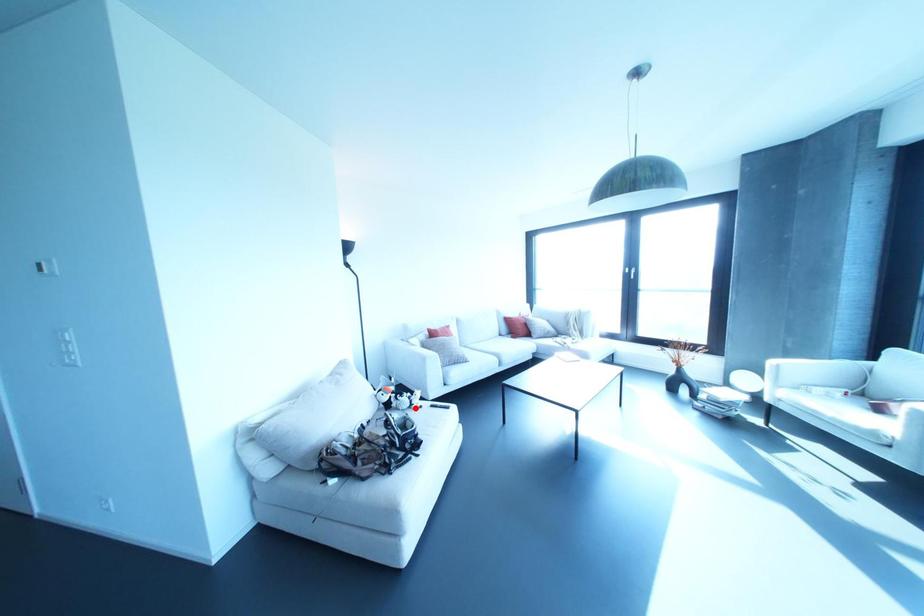
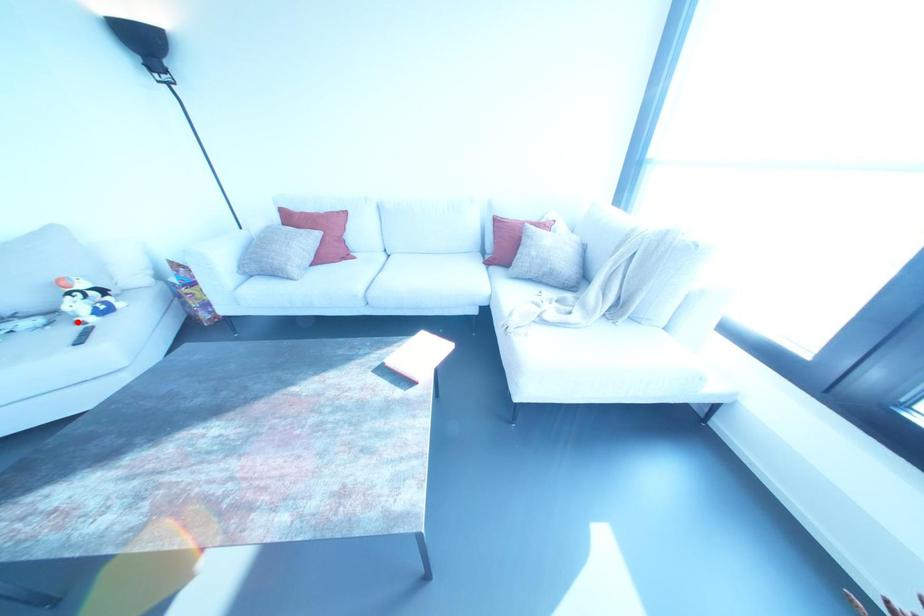
I am providing you with two images of the same scene from different viewpoints. A red point is marked on the first image and another point is marked on the second image. Is the red point in image1 aligned with the point shown in image2?

Yes